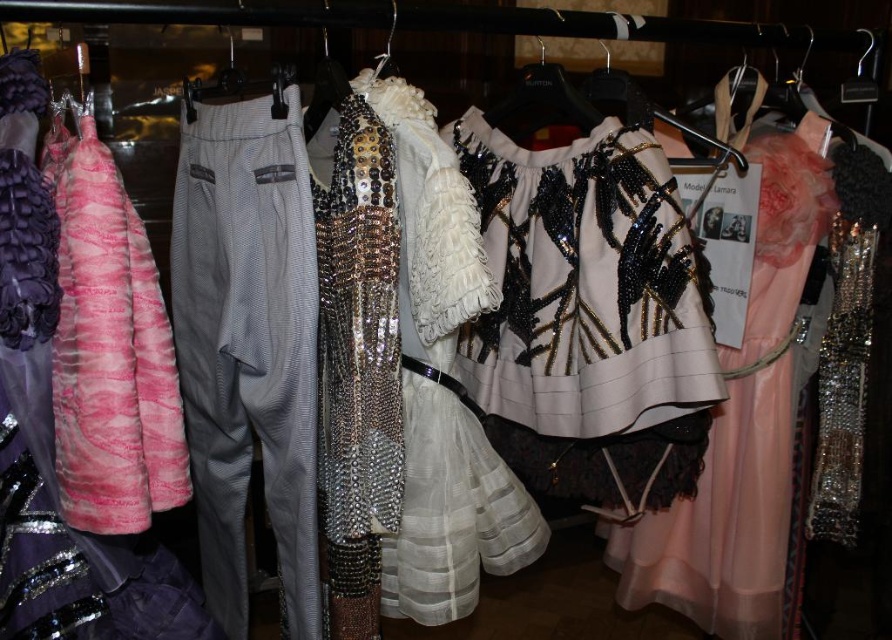
You are standing in front of the pale pink chiffon dress at center and want to take a photo with your camera. The camera has a minimum focusing distance of 1 meter. Can you take a clear photo of the dress without moving closer?

The pale pink chiffon dress at center and camera are 1.10 meters apart from each other. Since the minimum focusing distance is 1 meter, you can take a clear photo of the dress without moving closer.

You are a fashion designer trying to arrange these garments on a mannequin. The pale pink chiffon dress at center and the pink fur coat at left need to be placed side by side. Which garment should you place first to ensure they fit properly?

The pale pink chiffon dress at center might be wider than the pink fur coat at left, so you should place the pale pink chiffon dress at center first to accommodate its width.

You are a fashion designer who wants to display the pale pink chiffon dress at center and the pink fur coat at left in a store window. Which garment should you choose if you want to display a larger piece?

The pale pink chiffon dress at center has a larger size compared to the pink fur coat at left, so you should choose the pale pink chiffon dress at center for displaying a larger piece.